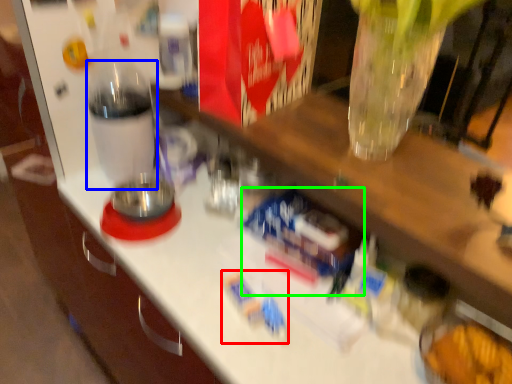
Question: Which object is the farthest from toy (highlighted by a red box)? Choose among these: bottle (highlighted by a blue box) or toy (highlighted by a green box).

Choices:
 (A) bottle
 (B) toy

Answer: (A)